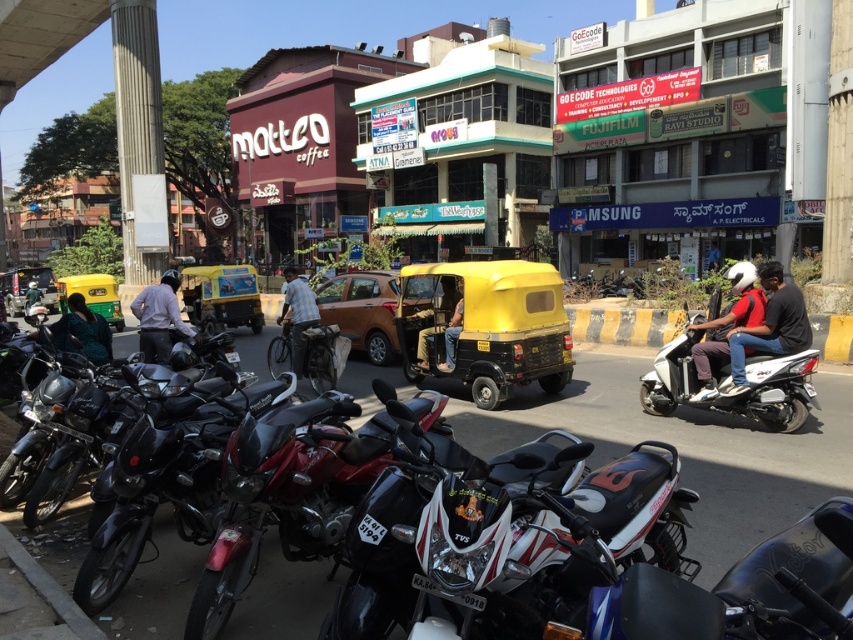
You are a photographer standing at the camera position. You want to capture a photo of the shiny black motorcycle at center. Is the motorcycle within your camera lens range of 3 meters?

The shiny black motorcycle at center and camera are 3.41 meters apart from each other, so the motorcycle is slightly out of the camera lens range of 3 meters.

You are a pedestrian standing at the intersection and see the shiny black motorcycle at center and the plaid shirt at center. Which object is positioned to the right of the other?

The shiny black motorcycle at center is to the right of the plaid shirt at center.